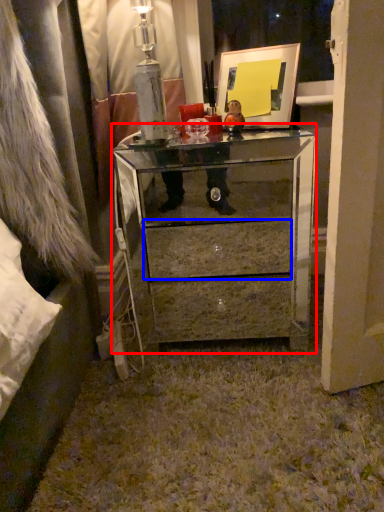
Question: Which object appears farthest to the camera in this image, chest of drawers (highlighted by a red box) or drawer (highlighted by a blue box)?

Choices:
 (A) chest of drawers
 (B) drawer

Answer: (B)